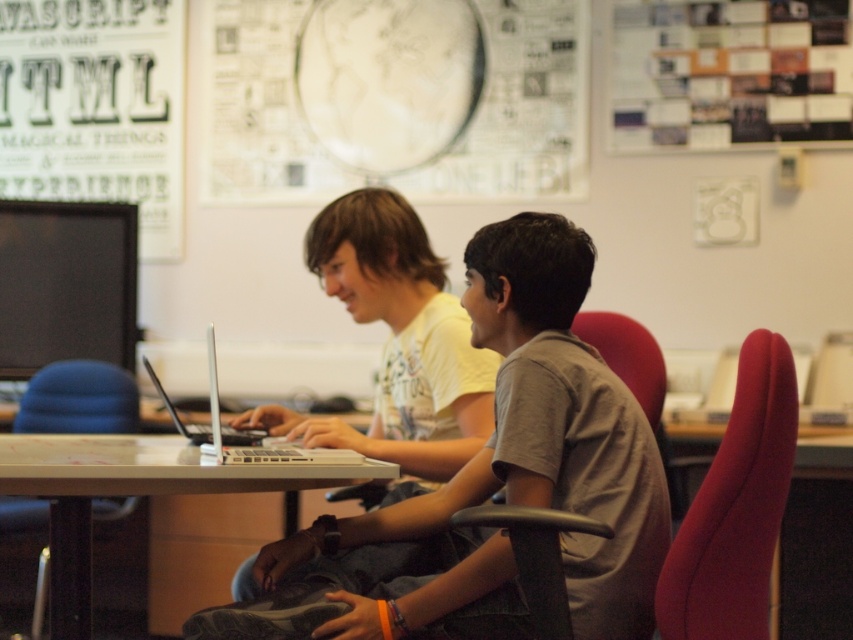
You are a photographer standing in front of the scene. You need to capture a photo where both the light brown shirt at center and the white glossy table at center are clearly visible. Based on their positions, which object should be in focus to ensure both are sharp?

The light brown shirt at center is above the white glossy table at center, so focusing on the light brown shirt at center will ensure both are sharp since it is closer to the camera.

You are a photographer trying to capture a group photo of the light brown shirt at center and the white glossy table at center. If you want to ensure both subjects are fully visible in the frame, which one requires more space horizontally?

The light brown shirt at center has a lesser width compared to the white glossy table at center, so the white glossy table at center requires more horizontal space to be fully visible in the frame.